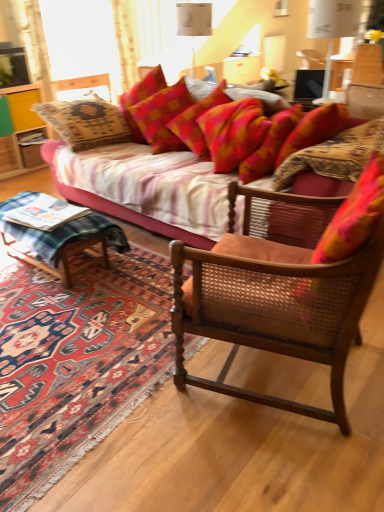
The height and width of the screenshot is (512, 384). What are the coordinates of `yellow wood cabinet at left` in the screenshot? It's located at (21, 132).

Where is `textured fabric couch at center`? This screenshot has height=512, width=384. textured fabric couch at center is located at coordinates (131, 215).

In order to face carpeted rug at lower left, should I rotate leftwards or rightwards?

A 18.556 degree turn to the left will do.

Find the location of `yellow wood cabinet at left`. yellow wood cabinet at left is located at coordinates (21, 132).

Considering the relative sizes of green plaid wood at lower left and carpeted rug at lower left in the image provided, is green plaid wood at lower left bigger than carpeted rug at lower left?

No, green plaid wood at lower left is not bigger than carpeted rug at lower left.

Is green plaid wood at lower left shorter than carpeted rug at lower left?

Incorrect, the height of green plaid wood at lower left does not fall short of that of carpeted rug at lower left.

Looking at their sizes, would you say green plaid wood at lower left is wider or thinner than carpeted rug at lower left?

green plaid wood at lower left is thinner than carpeted rug at lower left.

Is green plaid wood at lower left at the left side of carpeted rug at lower left?

Correct, you'll find green plaid wood at lower left to the left of carpeted rug at lower left.

Which is closer to the camera, (13,494) or (377,92)?

The point (13,494) is more forward.

Who is smaller, carpeted rug at lower left or textured fabric couch at center?

carpeted rug at lower left is smaller.

Find the location of a particular element. Image resolution: width=384 pixels, height=512 pixels. mat that is under the textured fabric couch at center (from a real-world perspective) is located at coordinates (76, 362).

Who is taller, carpeted rug at lower left or textured fabric couch at center?

Standing taller between the two is textured fabric couch at center.

From the image's perspective, is red plaid pillow at upper center under carpeted rug at lower left?

Incorrect, from the image's perspective, red plaid pillow at upper center is higher than carpeted rug at lower left.

Considering the relative positions of red plaid pillow at upper center and carpeted rug at lower left in the image provided, is red plaid pillow at upper center in front of carpeted rug at lower left?

That is False.

Which of these two, red plaid pillow at upper center or carpeted rug at lower left, is thinner?

Thinner between the two is red plaid pillow at upper center.

Are red plaid pillow at upper center and carpeted rug at lower left located far from each other?

Yes, red plaid pillow at upper center and carpeted rug at lower left are located far from each other.

Are wooden cane chair at center and yellow wood cabinet at left located far from each other?

Yes, wooden cane chair at center is far from yellow wood cabinet at left.

Considering the relative sizes of wooden cane chair at center and yellow wood cabinet at left in the image provided, is wooden cane chair at center bigger than yellow wood cabinet at left?

Indeed, wooden cane chair at center has a larger size compared to yellow wood cabinet at left.

Is wooden cane chair at center turned away from yellow wood cabinet at left?

No, wooden cane chair at center is not facing the opposite direction of yellow wood cabinet at left.

Is wooden cane chair at center outside of carpeted rug at lower left?

Absolutely, wooden cane chair at center is external to carpeted rug at lower left.

What's the angular difference between wooden cane chair at center and carpeted rug at lower left's facing directions?

There is a 104-degree angle between the facing directions of wooden cane chair at center and carpeted rug at lower left.

Between wooden cane chair at center and carpeted rug at lower left, which one is positioned behind?

carpeted rug at lower left is behind.

Is wooden cane chair at center to the left of carpeted rug at lower left from the viewer's perspective?

Incorrect, wooden cane chair at center is not on the left side of carpeted rug at lower left.

From the image's perspective, is green plaid wood at lower left on red plaid pillow at upper center?

No, from the image's perspective, green plaid wood at lower left is not over red plaid pillow at upper center.

The height and width of the screenshot is (512, 384). I want to click on coffee table located underneath the red plaid pillow at upper center (from a real-world perspective), so click(x=58, y=236).

Which is behind, green plaid wood at lower left or red plaid pillow at upper center?

red plaid pillow at upper center is behind.

Which of these two, wooden cane chair at center or green plaid wood at lower left, is thinner?

green plaid wood at lower left is thinner.

Consider the image. From a real-world perspective, which is physically above, wooden cane chair at center or green plaid wood at lower left?

wooden cane chair at center.

Which of these two, wooden cane chair at center or green plaid wood at lower left, stands taller?

wooden cane chair at center is taller.

Is wooden cane chair at center not within green plaid wood at lower left?

wooden cane chair at center lies outside green plaid wood at lower left's area.

You are a GUI agent. You are given a task and a screenshot of the screen. Output one action in this format:
    pyautogui.click(x=<x>, y=<y>)
    Task: Click on the mat lying on the right of green plaid wood at lower left
    This screenshot has height=512, width=384.
    Given the screenshot: What is the action you would take?
    pyautogui.click(x=76, y=362)

The image size is (384, 512). Identify the location of mat that is below the textured fabric couch at center (from the image's perspective). (76, 362).

Consider the image. Considering their positions, is yellow wood cabinet at left positioned further to wooden cane chair at center than carpeted rug at lower left?

yellow wood cabinet at left lies further to wooden cane chair at center than the other object.

Estimate the real-world distances between objects in this image. Which object is closer to yellow wood cabinet at left, green plaid wood at lower left or textured fabric couch at center?

The object closer to yellow wood cabinet at left is green plaid wood at lower left.

Considering their positions, is yellow wood cabinet at left positioned further to red plaid pillow at upper center than green plaid wood at lower left?

yellow wood cabinet at left lies further to red plaid pillow at upper center than the other object.

Considering their positions, is green plaid wood at lower left positioned closer to carpeted rug at lower left than wooden cane chair at center?

Among the two, green plaid wood at lower left is located nearer to carpeted rug at lower left.

Considering their positions, is textured fabric couch at center positioned further to yellow wood cabinet at left than wooden cane chair at center?

wooden cane chair at center.

From the image, which object appears to be nearer to red plaid pillow at upper center, carpeted rug at lower left or green plaid wood at lower left?

green plaid wood at lower left lies closer to red plaid pillow at upper center than the other object.

Considering their positions, is textured fabric couch at center positioned closer to green plaid wood at lower left than carpeted rug at lower left?

carpeted rug at lower left is closer to green plaid wood at lower left.

When comparing their distances from wooden cane chair at center, does red plaid pillow at upper center or carpeted rug at lower left seem further?

Based on the image, red plaid pillow at upper center appears to be further to wooden cane chair at center.

Locate an element on the screen. This screenshot has width=384, height=512. coffee table positioned between textured fabric couch at center and yellow wood cabinet at left from near to far is located at coordinates (58, 236).

The image size is (384, 512). In order to click on coffee table between wooden cane chair at center and red plaid pillow at upper center along the z-axis in this screenshot , I will do `click(58, 236)`.

Locate an element on the screen. coffee table positioned between carpeted rug at lower left and yellow wood cabinet at left from near to far is located at coordinates (58, 236).

Where is `studio couch between carpeted rug at lower left and red plaid pillow at upper center from front to back`? The image size is (384, 512). studio couch between carpeted rug at lower left and red plaid pillow at upper center from front to back is located at coordinates (131, 215).